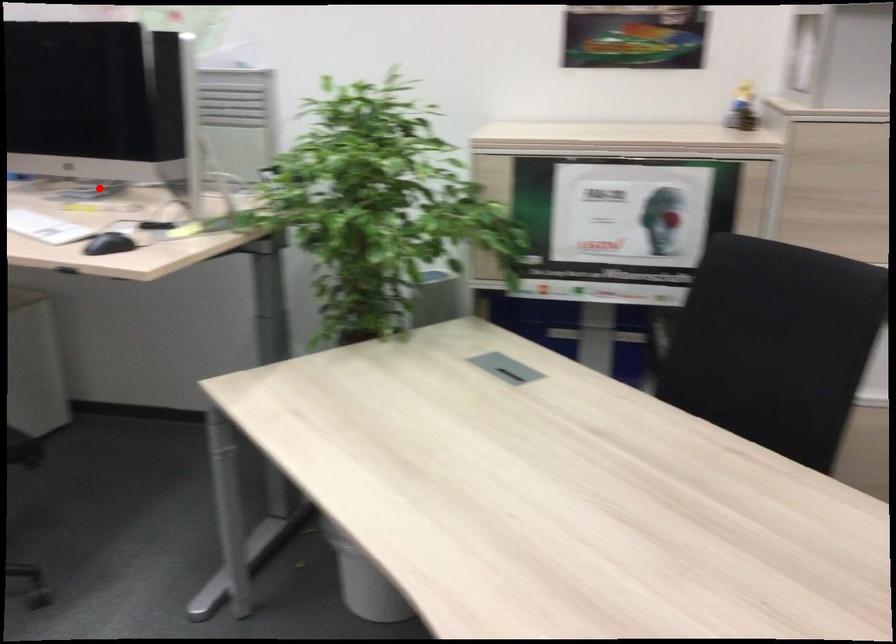
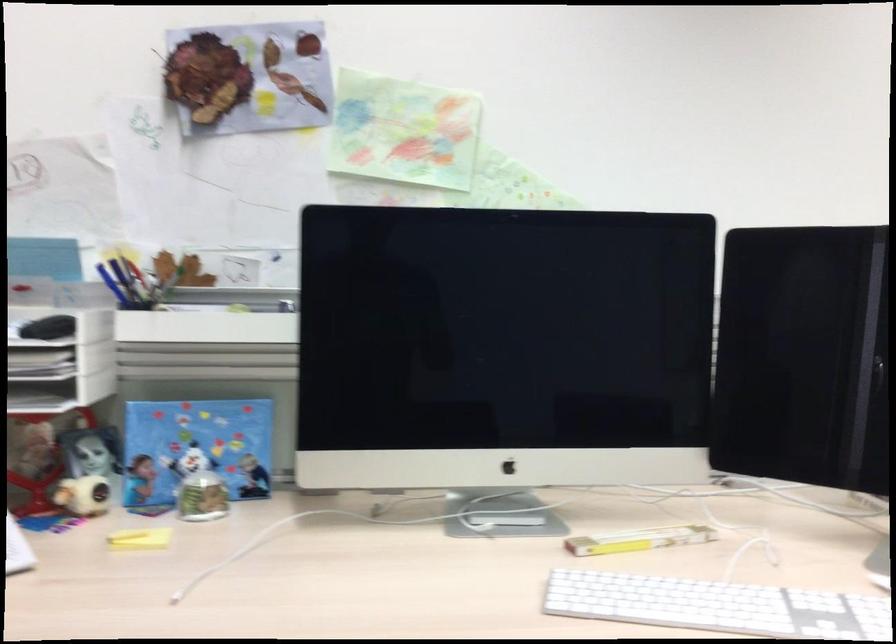
Question: A red point is marked in image1. In image2, is the corresponding 3D point closer to the camera or farther? Reply with the corresponding letter.

Choices:
 (A) The corresponding 3D point is closer.
 (B) The corresponding 3D point is farther.

Answer: (A)